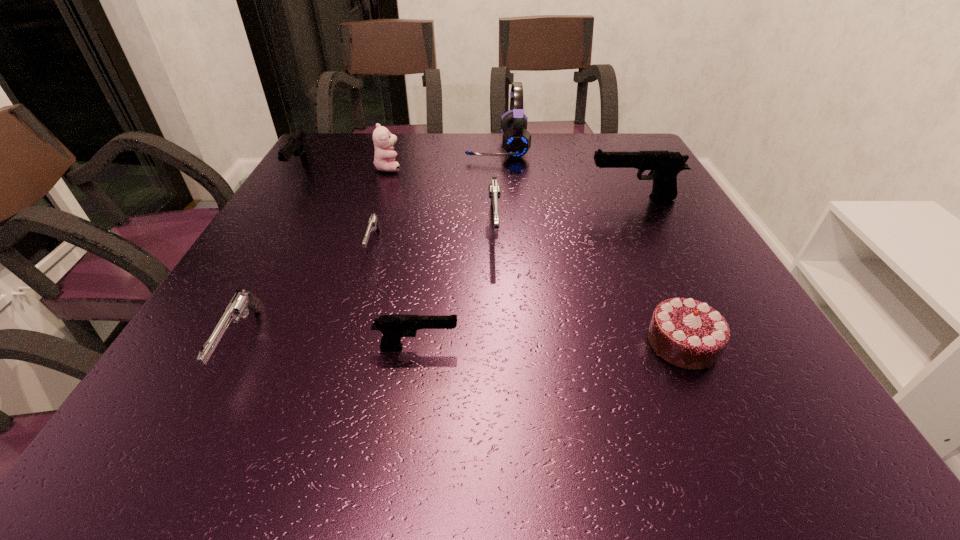
This screenshot has width=960, height=540. What are the coordinates of `empty space that is in between the smallest silver pistol and the leftmost object` in the screenshot? It's located at (338, 207).

Find the location of a particular element. The width and height of the screenshot is (960, 540). free space between the second silver pistol from left to right and the headset is located at coordinates (435, 195).

Where is `empty space between the smallest silver pistol and the second biggest silver pistol`? empty space between the smallest silver pistol and the second biggest silver pistol is located at coordinates click(307, 293).

Locate an element on the screen. The width and height of the screenshot is (960, 540). blank region between the shortest pistol and the tallest object is located at coordinates (435, 195).

This screenshot has width=960, height=540. I want to click on empty space between the second smallest silver pistol and the tallest object, so point(369,245).

Identify the location of free space that is in between the teddy bear and the headset. The width and height of the screenshot is (960, 540). (443, 158).

Locate an element on the screen. vacant area between the chocolate cake and the fifth pistol from left to right is located at coordinates (588, 285).

The width and height of the screenshot is (960, 540). What are the coordinates of `empty space that is in between the chocolate chocolate cake and the nearest black pistol` in the screenshot? It's located at (550, 345).

Locate which object is the seventh closest to the teddy bear. Please provide its 2D coordinates. Your answer should be formatted as a tuple, i.e. [(x, y)], where the tuple contains the x and y coordinates of a point satisfying the conditions above.

[(393, 327)]

Image resolution: width=960 pixels, height=540 pixels. I want to click on object that ranks as the eighth closest to the rightmost black pistol, so click(x=241, y=302).